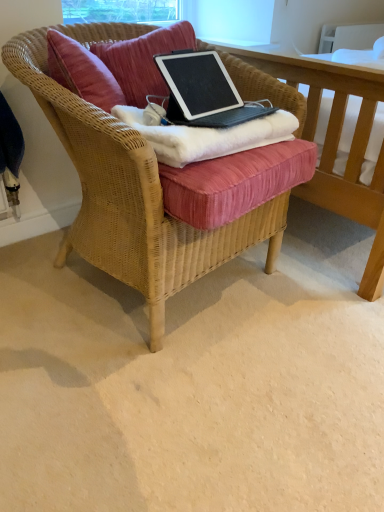
The width and height of the screenshot is (384, 512). What do you see at coordinates (337, 145) in the screenshot?
I see `wooden bed frame at upper right` at bounding box center [337, 145].

The width and height of the screenshot is (384, 512). I want to click on woven wicker chair at center, so click(131, 197).

In order to click on velvet cushion at center in this screenshot , I will do `click(143, 60)`.

From the image's perspective, is velvet cushion at center over black matte laptop at center?

Yes, from the image's perspective, velvet cushion at center is above black matte laptop at center.

Between velvet cushion at center and black matte laptop at center, which one is positioned in front?

black matte laptop at center.

Does point (135, 39) come behind point (245, 114)?

Yes, point (135, 39) is behind point (245, 114).

Is white fluffy blanket at center bigger than black matte laptop at center?

Correct, white fluffy blanket at center is larger in size than black matte laptop at center.

Which is correct: white fluffy blanket at center is inside black matte laptop at center, or outside of it?

white fluffy blanket at center is not inside black matte laptop at center, it's outside.

Find the location of a particular element. The height and width of the screenshot is (512, 384). blanket in front of the black matte laptop at center is located at coordinates (204, 135).

Which object is closer to the camera taking this photo, velvet cushion at center or wooden bed frame at upper right?

wooden bed frame at upper right is in front.

Can you confirm if velvet cushion at center is wider than wooden bed frame at upper right?

Incorrect, the width of velvet cushion at center does not surpass that of wooden bed frame at upper right.

Between point (122, 48) and point (370, 215), which one is positioned in front?

The point (122, 48) is in front.

Is wooden bed frame at upper right surrounded by velvet cushion at center?

Actually, wooden bed frame at upper right is outside velvet cushion at center.

Would you say wooden bed frame at upper right is outside black matte laptop at center?

That's correct, wooden bed frame at upper right is outside of black matte laptop at center.

Between point (340, 198) and point (173, 69), which one is positioned in front?

Positioned in front is point (340, 198).

Looking at this image, can you confirm if wooden bed frame at upper right is wider than black matte laptop at center?

Correct, the width of wooden bed frame at upper right exceeds that of black matte laptop at center.

From a real-world perspective, which object stands above the other?

In real-world perspective, black matte laptop at center is above.

Between woven wicker chair at center and black matte laptop at center, which one has smaller width?

Thinner between the two is black matte laptop at center.

Is point (158, 191) more distant than point (172, 54)?

No, (158, 191) is in front of (172, 54).

Is woven wicker chair at center not within black matte laptop at center?

Yes, woven wicker chair at center is located beyond the bounds of black matte laptop at center.

Considering the sizes of objects white fluffy blanket at center and woven wicker chair at center in the image provided, who is smaller, white fluffy blanket at center or woven wicker chair at center?

white fluffy blanket at center is smaller.

What's the angular difference between white fluffy blanket at center and woven wicker chair at center's facing directions?

The angular difference between white fluffy blanket at center and woven wicker chair at center is 5.04 degrees.

Considering the points (150, 134) and (221, 238), which point is behind, point (150, 134) or point (221, 238)?

The point (221, 238) is behind.

Which object is thinner, white fluffy blanket at center or woven wicker chair at center?

With smaller width is white fluffy blanket at center.

From the picture: From the image's perspective, which is above, white fluffy blanket at center or wooden bed frame at upper right?

wooden bed frame at upper right.

Between white fluffy blanket at center and wooden bed frame at upper right, which one has less height?

Standing shorter between the two is white fluffy blanket at center.

Which of these two, white fluffy blanket at center or wooden bed frame at upper right, is bigger?

Bigger between the two is wooden bed frame at upper right.

This screenshot has height=512, width=384. Find the location of `table on the right of white fluffy blanket at center`. table on the right of white fluffy blanket at center is located at coordinates [x=337, y=145].

What are the coordinates of `pillow below the black matte laptop at center (from a real-world perspective)` in the screenshot? It's located at (143, 60).

Locate an element on the screen. blanket on the left of black matte laptop at center is located at coordinates (204, 135).

Estimate the real-world distances between objects in this image. Which object is further from black matte laptop at center, white fluffy blanket at center or woven wicker chair at center?

woven wicker chair at center is positioned further to the anchor black matte laptop at center.

When comparing their distances from velvet cushion at center, does woven wicker chair at center or wooden bed frame at upper right seem closer?

woven wicker chair at center lies closer to velvet cushion at center than the other object.

Looking at the image, which one is located further to wooden bed frame at upper right, velvet cushion at center or white fluffy blanket at center?

velvet cushion at center is further to wooden bed frame at upper right.

When comparing their distances from wooden bed frame at upper right, does velvet cushion at center or black matte laptop at center seem further?

Based on the image, velvet cushion at center appears to be further to wooden bed frame at upper right.

Estimate the real-world distances between objects in this image. Which object is closer to velvet cushion at center, wooden bed frame at upper right or white fluffy blanket at center?

Result: Among the two, white fluffy blanket at center is located nearer to velvet cushion at center.

From the picture: Based on their spatial positions, is velvet cushion at center or wooden bed frame at upper right closer to white fluffy blanket at center?

Among the two, velvet cushion at center is located nearer to white fluffy blanket at center.

Based on their spatial positions, is black matte laptop at center or white fluffy blanket at center further from woven wicker chair at center?

Based on the image, black matte laptop at center appears to be further to woven wicker chair at center.

Estimate the real-world distances between objects in this image. Which object is further from woven wicker chair at center, velvet cushion at center or wooden bed frame at upper right?

wooden bed frame at upper right is positioned further to the anchor woven wicker chair at center.

This screenshot has width=384, height=512. Identify the location of blanket positioned between woven wicker chair at center and velvet cushion at center from near to far. (204, 135).

Locate an element on the screen. This screenshot has height=512, width=384. chair between velvet cushion at center and wooden bed frame at upper right from left to right is located at coordinates (131, 197).

At what (x,y) coordinates should I click in order to perform the action: click on laptop between white fluffy blanket at center and wooden bed frame at upper right in the horizontal direction. Please return your answer as a coordinate pair (x, y). Looking at the image, I should click on (204, 91).

The image size is (384, 512). In order to click on laptop between woven wicker chair at center and wooden bed frame at upper right from left to right in this screenshot , I will do (204, 91).